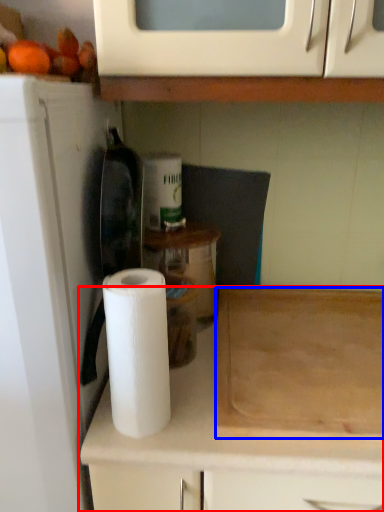
Question: Which object appears closest to the camera in this image, cabinetry (highlighted by a red box) or cutting board (highlighted by a blue box)?

Choices:
 (A) cabinetry
 (B) cutting board

Answer: (A)